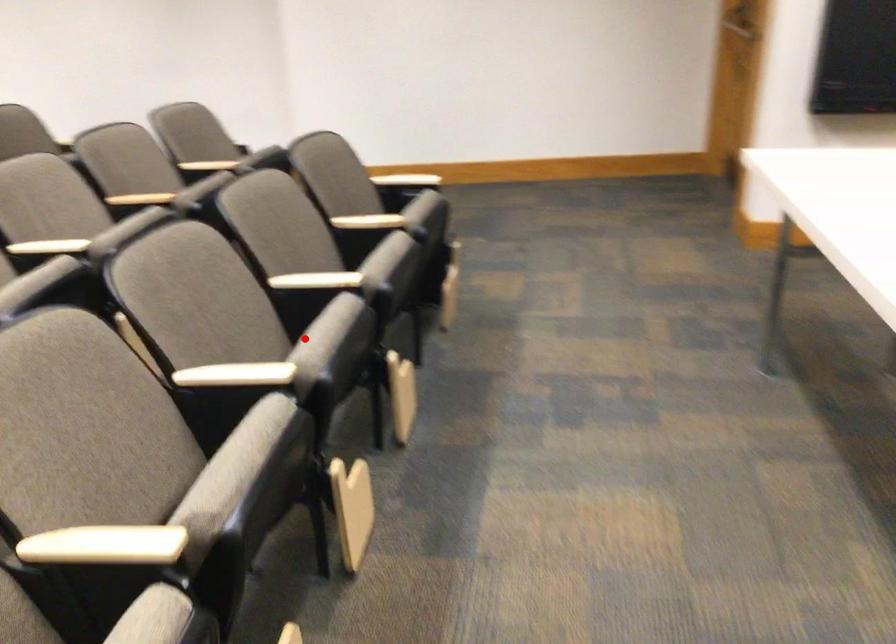
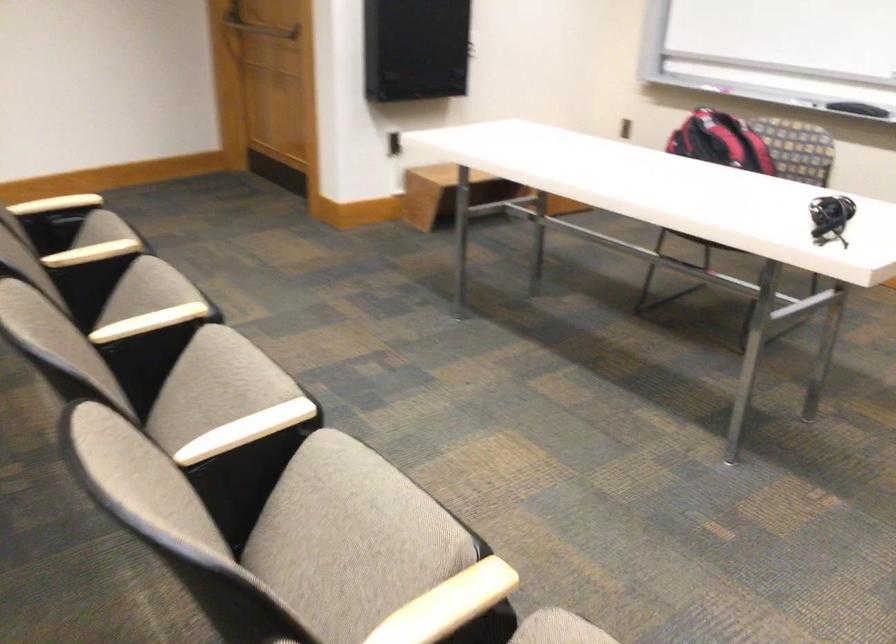
Question: I am providing you with two images of the same scene from different viewpoints. In image1, a red point is highlighted. Considering the same 3D point in image2, which of the following is correct?

Choices:
 (A) It is closer
 (B) It is farther

Answer: (A)